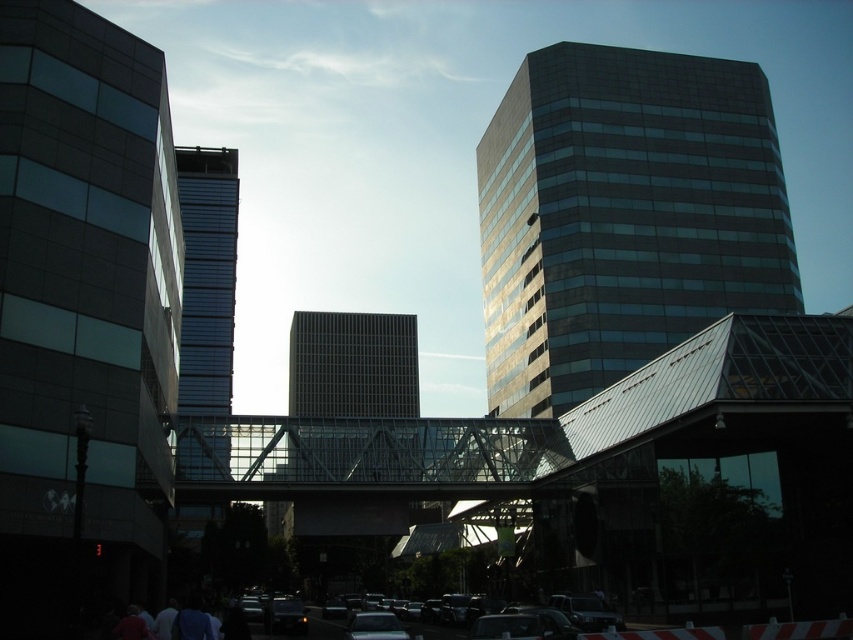
Who is more distant from viewer, (126,346) or (473,433)?

Positioned behind is point (473,433).

Does point (160, 333) lie behind point (540, 454)?

No.

Which is behind, point (80, 584) or point (489, 483)?

The point (489, 483) is behind.

The image size is (853, 640). In order to click on glassy reflective building at left in this screenshot , I will do `click(83, 308)`.

Can you confirm if matte glass tower at center is positioned to the right of shiny black car at lower center?

No, matte glass tower at center is not to the right of shiny black car at lower center.

This screenshot has width=853, height=640. Identify the location of matte glass tower at center. (352, 396).

Consider the image. Which is more to the right, shiny glass building at center or transparent glass bridge at center?

shiny glass building at center

Find the location of a particular element. The width and height of the screenshot is (853, 640). shiny glass building at center is located at coordinates (624, 216).

Is point (608, 346) positioned behind point (421, 433)?

Yes, point (608, 346) is farther from viewer.

Locate an element on the screen. shiny glass building at center is located at coordinates (624, 216).